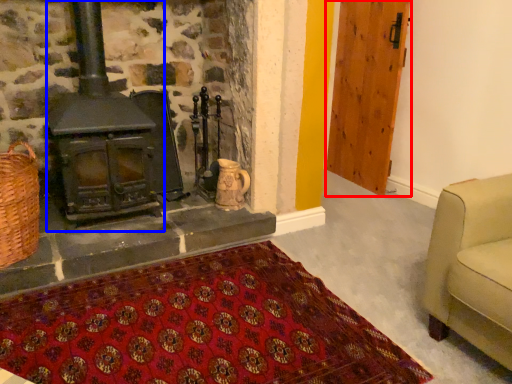
Question: Among these objects, which one is nearest to the camera, door (highlighted by a red box) or wood burning stove (highlighted by a blue box)?

Choices:
 (A) door
 (B) wood burning stove

Answer: (B)